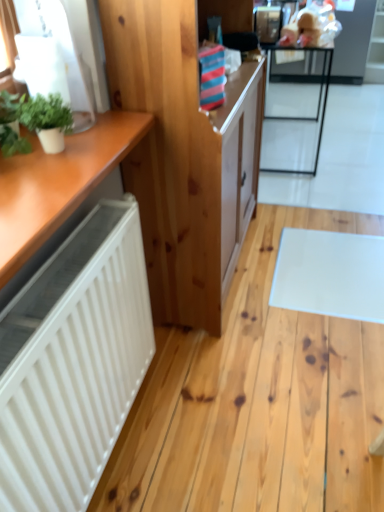
Question: Based on their sizes in the image, would you say green matte plant at upper left, positioned as the 2th houseplant in left-to-right order, is bigger or smaller than green leafy plant at left, which is the second houseplant from right to left?

Choices:
 (A) big
 (B) small

Answer: (B)

Question: Is point (46, 105) closer or farther from the camera than point (14, 97)?

Choices:
 (A) closer
 (B) farther

Answer: (A)

Question: Which object is positioned farthest from the green matte plant at upper left, positioned as the 2th houseplant in left-to-right order?

Choices:
 (A) green leafy plant at left, positioned as the 1th houseplant in left-to-right order
 (B) natural wood cabinet at center
 (C) metallic black table at upper right

Answer: (C)

Question: Which object is positioned farthest from the metallic black table at upper right?

Choices:
 (A) green matte plant at upper left, which is the first houseplant in right-to-left order
 (B) natural wood cabinet at center
 (C) green leafy plant at left, positioned as the 1th houseplant in left-to-right order

Answer: (C)